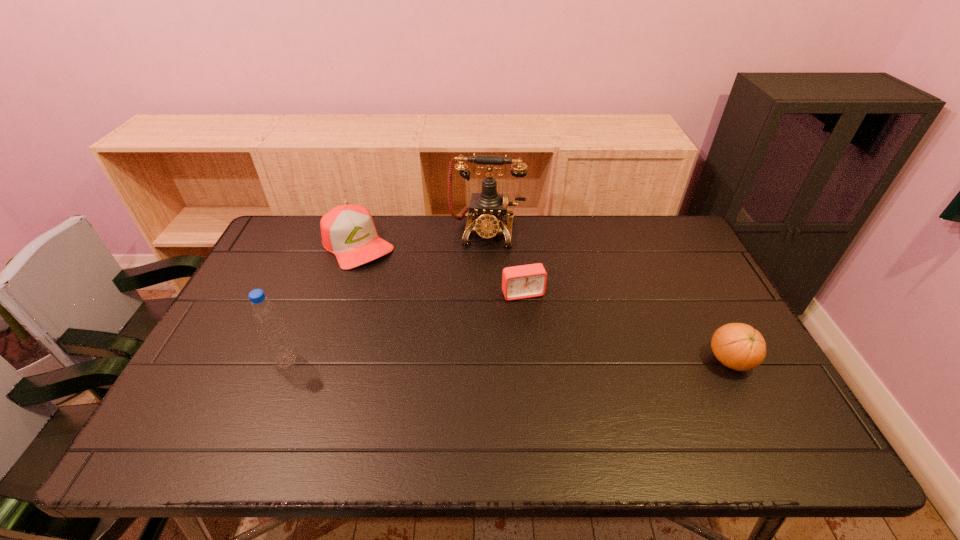
Find the location of a particular element. vacant region that satisfies the following two spatial constraints: 1. on the back side of the baseball cap; 2. on the right side of the second tallest object is located at coordinates (333, 245).

Find the location of a particular element. free spot that satisfies the following two spatial constraints: 1. on the back side of the baseball cap; 2. on the left side of the fourth shortest object is located at coordinates (333, 245).

Where is `vacant space that satisfies the following two spatial constraints: 1. on the back side of the baseball cap; 2. on the left side of the tallest object`? vacant space that satisfies the following two spatial constraints: 1. on the back side of the baseball cap; 2. on the left side of the tallest object is located at coordinates (362, 232).